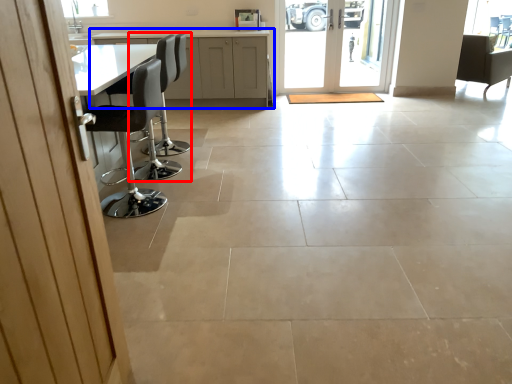
Question: Which object is further to the camera taking this photo, chair (highlighted by a red box) or cabinetry (highlighted by a blue box)?

Choices:
 (A) chair
 (B) cabinetry

Answer: (B)